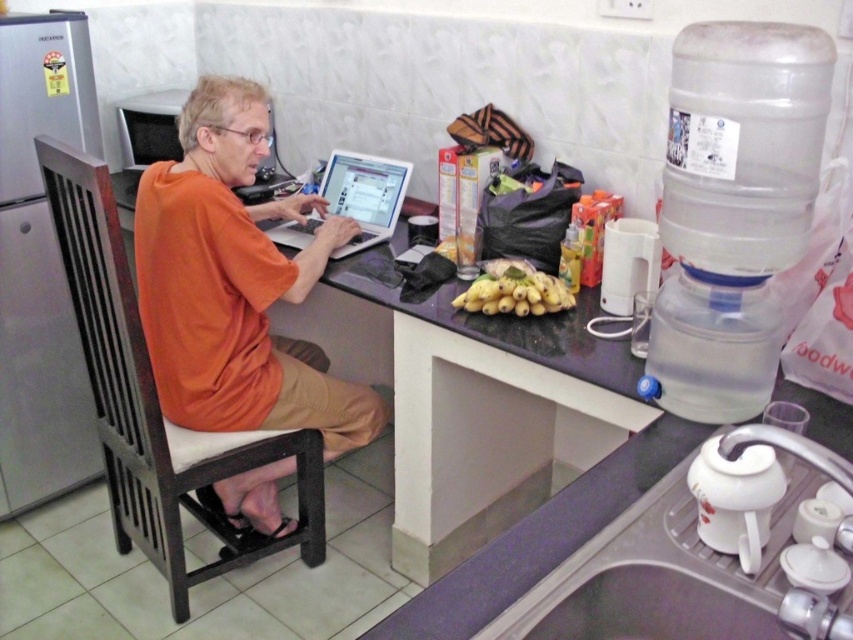
Between white ceramic sink at lower right and silver metallic laptop at center, which one appears on the right side from the viewer's perspective?

Positioned to the right is white ceramic sink at lower right.

Does white ceramic sink at lower right lie in front of silver metallic laptop at center?

Yes, white ceramic sink at lower right is in front of silver metallic laptop at center.

Measure the distance between point (643,509) and camera.

The distance of point (643,509) from camera is 3.77 feet.

Where is `white ceramic sink at lower right`? white ceramic sink at lower right is located at coordinates (693, 557).

Consider the image. Can you confirm if silver metallic laptop at center is taller than yellow matte bananas at center?

Yes.

Who is higher up, silver metallic laptop at center or yellow matte bananas at center?

silver metallic laptop at center is higher up.

Who is more forward, (381, 202) or (496, 275)?

Point (496, 275)

Identify the location of silver metallic laptop at center. This screenshot has width=853, height=640. (364, 195).

In the scene shown: Is orange cotton shirt at center to the left of purple laminate counter at center from the viewer's perspective?

Correct, you'll find orange cotton shirt at center to the left of purple laminate counter at center.

Who is taller, orange cotton shirt at center or purple laminate counter at center?

With more height is orange cotton shirt at center.

Who is more forward, (259, 404) or (340, 273)?

Point (259, 404) is in front.

The width and height of the screenshot is (853, 640). Identify the location of orange cotton shirt at center. (235, 284).